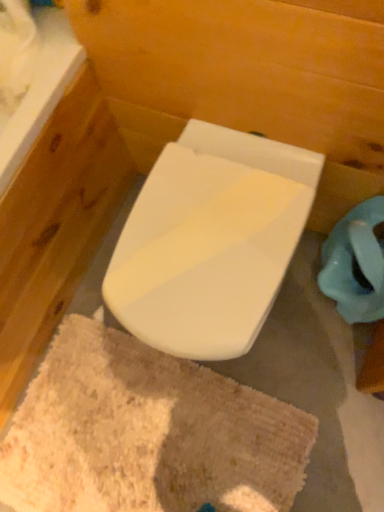
This screenshot has width=384, height=512. In order to click on white glossy toilet at center in this screenshot , I will do `click(210, 241)`.

This screenshot has width=384, height=512. What do you see at coordinates (210, 241) in the screenshot? I see `white glossy toilet at center` at bounding box center [210, 241].

You are a GUI agent. You are given a task and a screenshot of the screen. Output one action in this format:
    pyautogui.click(x=<x>, y=<y>)
    Task: Click on the beige shaggy bath mat at center
    
    Given the screenshot: What is the action you would take?
    pyautogui.click(x=147, y=433)

What do you see at coordinates (147, 433) in the screenshot? I see `beige shaggy bath mat at center` at bounding box center [147, 433].

Find the location of `white glossy toilet at center`. white glossy toilet at center is located at coordinates (210, 241).

Considering the relative positions of white glossy toilet at center and beige shaggy bath mat at center in the image provided, is white glossy toilet at center to the right of beige shaggy bath mat at center from the viewer's perspective?

Correct, you'll find white glossy toilet at center to the right of beige shaggy bath mat at center.

Considering the positions of objects white glossy toilet at center and beige shaggy bath mat at center in the image provided, who is in front, white glossy toilet at center or beige shaggy bath mat at center?

white glossy toilet at center.

Does point (270, 165) come closer to viewer compared to point (141, 444)?

Yes, it is in front of point (141, 444).

Based on the photo, from the image's perspective, which one is positioned higher, white glossy toilet at center or beige shaggy bath mat at center?

white glossy toilet at center.

From a real-world perspective, who is located lower, white glossy toilet at center or beige shaggy bath mat at center?

beige shaggy bath mat at center.

Which of these two, white glossy toilet at center or beige shaggy bath mat at center, is thinner?

Thinner between the two is white glossy toilet at center.

Is white glossy toilet at center taller than beige shaggy bath mat at center?

Indeed, white glossy toilet at center has a greater height compared to beige shaggy bath mat at center.

Can you confirm if white glossy toilet at center is smaller than beige shaggy bath mat at center?

No, white glossy toilet at center is not smaller than beige shaggy bath mat at center.

Consider the image. Is white glossy toilet at center outside of beige shaggy bath mat at center?

Yes, white glossy toilet at center is located beyond the bounds of beige shaggy bath mat at center.

Is white glossy toilet at center not close to beige shaggy bath mat at center?

white glossy toilet at center is near beige shaggy bath mat at center, not far away.

Could you tell me if white glossy toilet at center is facing beige shaggy bath mat at center?

Yes, white glossy toilet at center is aimed at beige shaggy bath mat at center.

In the image, there is a beige shaggy bath mat at center. At what (x,y) coordinates should I click in order to perform the action: click on toilet above it (from the image's perspective). Please return your answer as a coordinate pair (x, y). The image size is (384, 512). Looking at the image, I should click on (210, 241).

Between beige shaggy bath mat at center and white glossy toilet at center, which one appears on the right side from the viewer's perspective?

white glossy toilet at center.

Based on the photo, which object is further away from the camera, beige shaggy bath mat at center or white glossy toilet at center?

beige shaggy bath mat at center is more distant.

Is point (51, 469) closer to viewer compared to point (216, 256)?

That is False.

From the image's perspective, between beige shaggy bath mat at center and white glossy toilet at center, which one is located above?

white glossy toilet at center, from the image's perspective.

From a real-world perspective, is beige shaggy bath mat at center located beneath white glossy toilet at center?

Yes.

In the scene shown: Considering the relative sizes of beige shaggy bath mat at center and white glossy toilet at center in the image provided, is beige shaggy bath mat at center wider than white glossy toilet at center?

Indeed, beige shaggy bath mat at center has a greater width compared to white glossy toilet at center.

Who is taller, beige shaggy bath mat at center or white glossy toilet at center?

Standing taller between the two is white glossy toilet at center.

Between beige shaggy bath mat at center and white glossy toilet at center, which one has smaller size?

Smaller between the two is beige shaggy bath mat at center.

Is beige shaggy bath mat at center inside the boundaries of white glossy toilet at center, or outside?

beige shaggy bath mat at center is spatially situated outside white glossy toilet at center.

Is beige shaggy bath mat at center not close to white glossy toilet at center?

beige shaggy bath mat at center is near white glossy toilet at center, not far away.

Could you tell me if beige shaggy bath mat at center is turned towards white glossy toilet at center?

No, beige shaggy bath mat at center is not oriented towards white glossy toilet at center.

Can you tell me how much beige shaggy bath mat at center and white glossy toilet at center differ in facing direction?

There is a 0.573-degree angle between the facing directions of beige shaggy bath mat at center and white glossy toilet at center.

How far apart are beige shaggy bath mat at center and white glossy toilet at center?

49.87 centimeters.

Locate an element on the screen. This screenshot has height=512, width=384. bath mat below the white glossy toilet at center (from the image's perspective) is located at coordinates pyautogui.click(x=147, y=433).

Find the location of a particular element. The width and height of the screenshot is (384, 512). toilet lying on the right of beige shaggy bath mat at center is located at coordinates (210, 241).

Find the location of `bath mat below the white glossy toilet at center (from a real-world perspective)`. bath mat below the white glossy toilet at center (from a real-world perspective) is located at coordinates (147, 433).